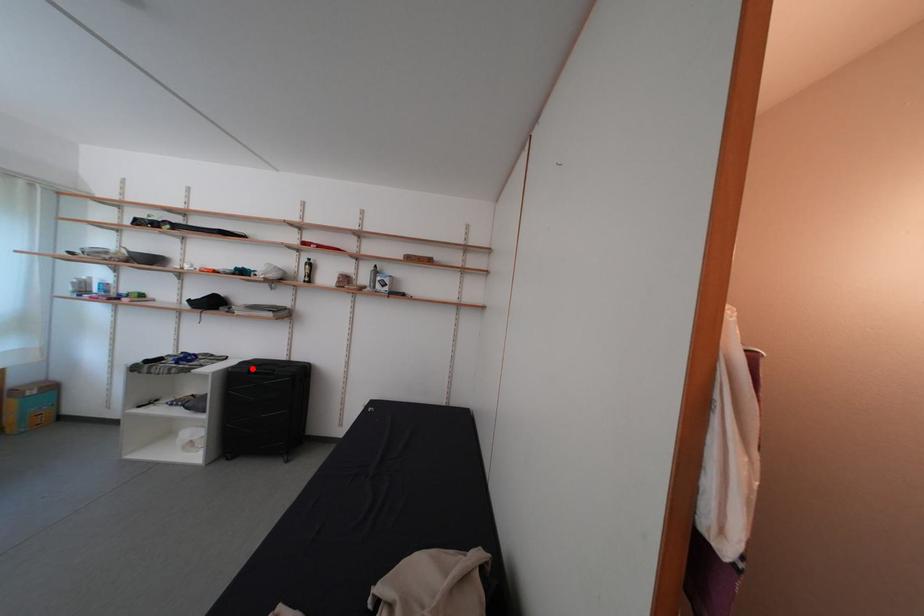
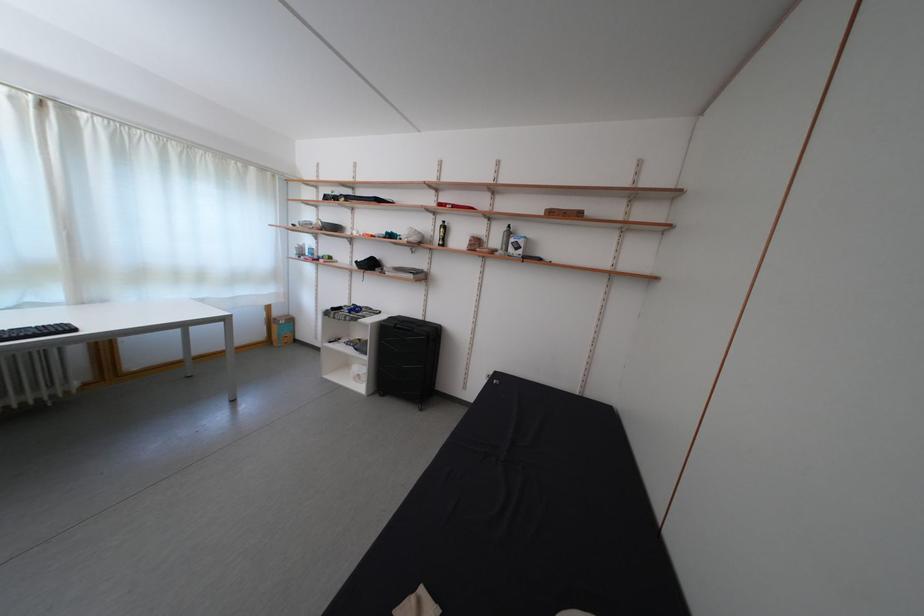
The point at the highlighted location is marked in the first image. Where is the corresponding point in the second image?

(399, 323)